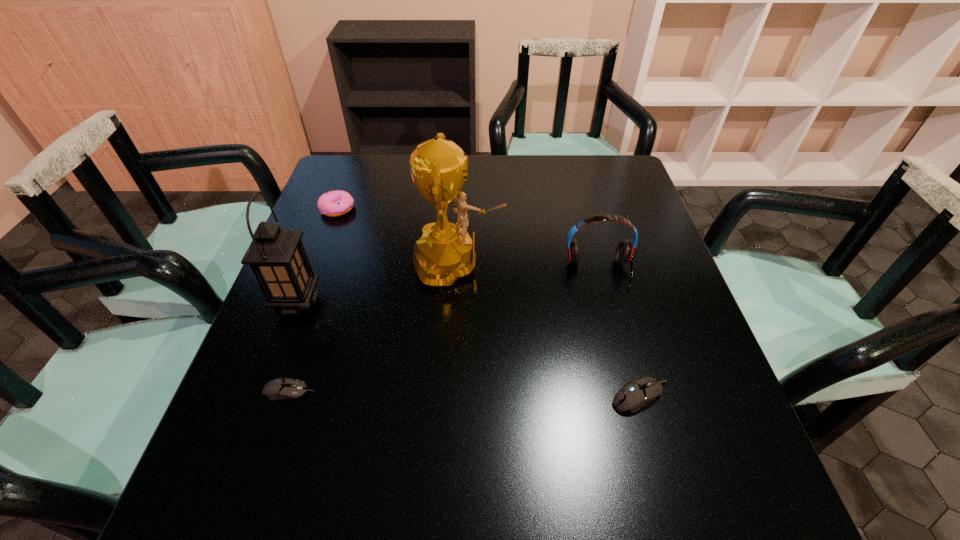
The width and height of the screenshot is (960, 540). Identify the location of free space located on the back of the taller computer mouse. (611, 289).

At what (x,y) coordinates should I click in order to perform the action: click on blank area located on the front of the doughnut. Please return your answer as a coordinate pair (x, y). The width and height of the screenshot is (960, 540). Looking at the image, I should click on (302, 302).

Locate an element on the screen. Image resolution: width=960 pixels, height=540 pixels. free spot located with the microphone attached to the side of the headset is located at coordinates (609, 310).

The width and height of the screenshot is (960, 540). Identify the location of vacant space situated on the front side of the award. (656, 264).

This screenshot has width=960, height=540. I want to click on free space located on the front of the second tallest object, so click(x=282, y=342).

Image resolution: width=960 pixels, height=540 pixels. Identify the location of object that is positioned at the far edge. (335, 203).

Image resolution: width=960 pixels, height=540 pixels. I want to click on object that is at the near edge, so click(635, 393).

The width and height of the screenshot is (960, 540). I want to click on computer mouse present at the left edge, so click(x=281, y=388).

This screenshot has height=540, width=960. Identify the location of doughnut at the left edge. (335, 203).

This screenshot has height=540, width=960. Identify the location of lantern located in the left edge section of the desktop. (276, 256).